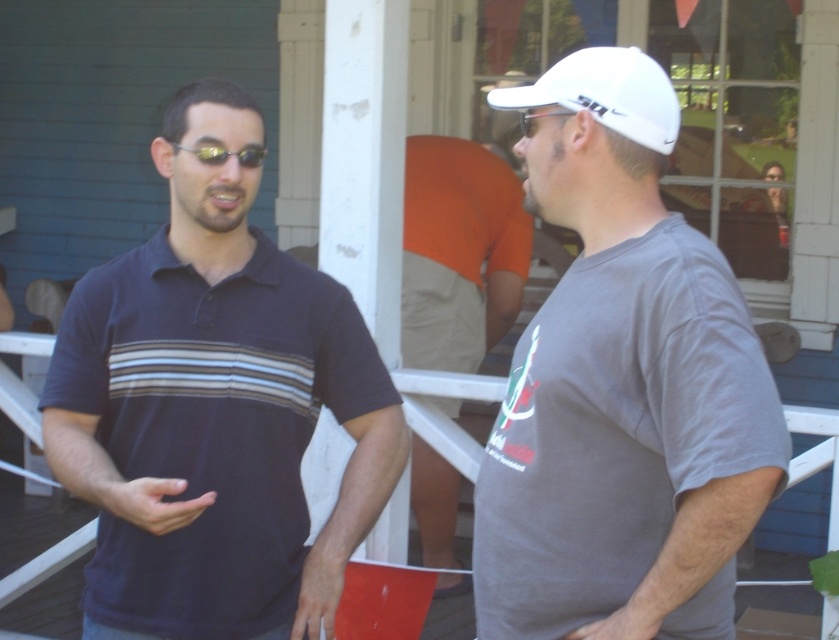
From the picture: Is gray matte t-shirt at right thinner than clear plastic goggles at center?

No, gray matte t-shirt at right is not thinner than clear plastic goggles at center.

Between point (634, 547) and point (529, 128), which one is positioned in front?

Point (634, 547) is in front.

Is point (540, 456) farther from camera compared to point (530, 116)?

No, (540, 456) is in front of (530, 116).

The width and height of the screenshot is (839, 640). Identify the location of gray matte t-shirt at right. (621, 388).

Which is above, gray matte t-shirt at right or shiny black sunglasses at center?

shiny black sunglasses at center is above.

Is point (506, 396) positioned in front of point (180, 144)?

That is True.

The width and height of the screenshot is (839, 640). In order to click on gray matte t-shirt at right in this screenshot , I will do `click(621, 388)`.

This screenshot has height=640, width=839. Find the location of `orange cotton shirt at center`. orange cotton shirt at center is located at coordinates (459, 252).